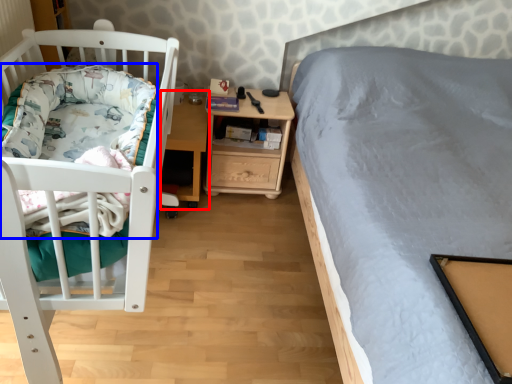
Question: Which object appears farthest to the camera in this image, table (highlighted by a red box) or blanket (highlighted by a blue box)?

Choices:
 (A) table
 (B) blanket

Answer: (A)